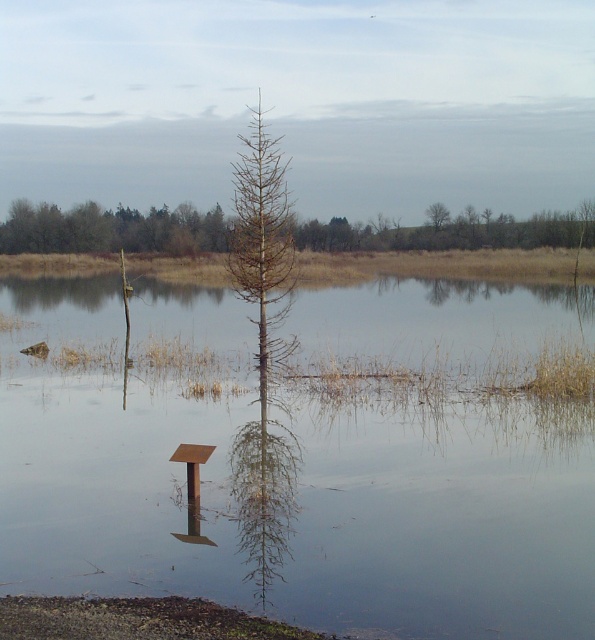
Does point (121, 218) come farther from viewer compared to point (446, 214)?

Yes, point (121, 218) is behind point (446, 214).

Image resolution: width=595 pixels, height=640 pixels. I want to click on brown wood tree at upper center, so click(x=111, y=228).

Can you confirm if brown/dried wood tree at upper center is thinner than brown textured tree at upper center?

Incorrect, brown/dried wood tree at upper center's width is not less than brown textured tree at upper center's.

Based on the photo, can you confirm if brown/dried wood tree at upper center is wider than brown textured tree at upper center?

Yes, brown/dried wood tree at upper center is wider than brown textured tree at upper center.

I want to click on brown/dried wood tree at upper center, so click(111, 228).

Does brown/dried wood tree at upper center appear on the right side of brown wood tree at upper center?

Correct, you'll find brown/dried wood tree at upper center to the right of brown wood tree at upper center.

Between brown/dried wood tree at upper center and brown wood tree at upper center, which one has less height?

brown wood tree at upper center is shorter.

You are a GUI agent. You are given a task and a screenshot of the screen. Output one action in this format:
    pyautogui.click(x=<x>, y=<y>)
    Task: Click on the brown/dried wood tree at upper center
    This screenshot has height=640, width=595.
    Given the screenshot: What is the action you would take?
    pyautogui.click(x=111, y=228)